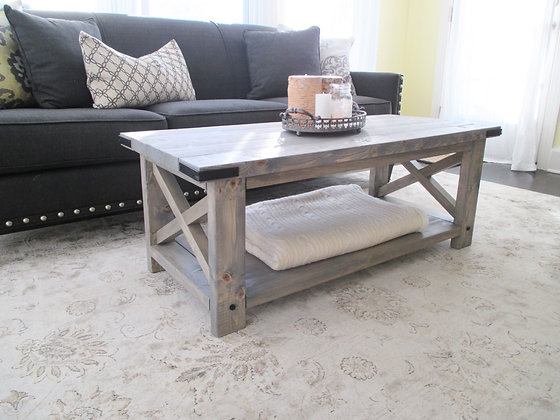
At what (x,y) coordinates should I click in order to perform the action: click on jar. Please return your answer as a coordinate pair (x, y). Looking at the image, I should click on (345, 101).